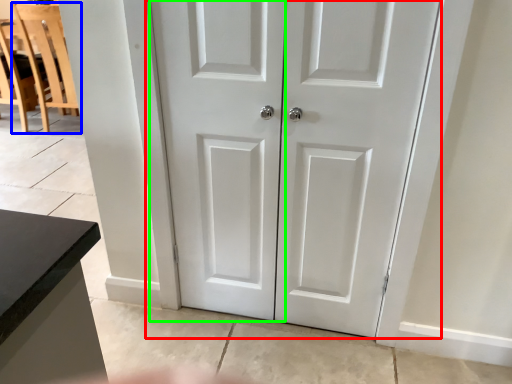
Question: Which object is the farthest from door (highlighted by a red box)? Choose among these: chair (highlighted by a blue box) or screen door (highlighted by a green box).

Choices:
 (A) chair
 (B) screen door

Answer: (A)